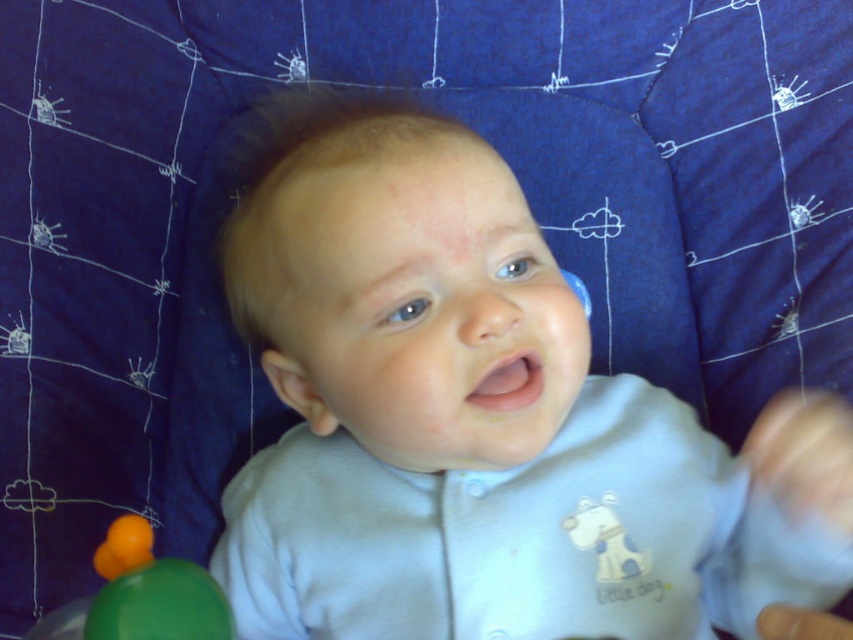
Question: Where is light blue fabric baby at center located in relation to green rubber ball at lower left in the image?

Choices:
 (A) below
 (B) above

Answer: (B)

Question: Which of the following is the farthest from the observer?

Choices:
 (A) light blue fabric baby at center
 (B) green rubber ball at lower left

Answer: (A)

Question: Does light blue fabric baby at center have a greater width compared to green rubber ball at lower left?

Choices:
 (A) yes
 (B) no

Answer: (A)

Question: Which of the following is the closest to the observer?

Choices:
 (A) light blue fabric baby at center
 (B) green rubber ball at lower left

Answer: (B)

Question: Can you confirm if light blue fabric baby at center is positioned below green rubber ball at lower left?

Choices:
 (A) no
 (B) yes

Answer: (A)